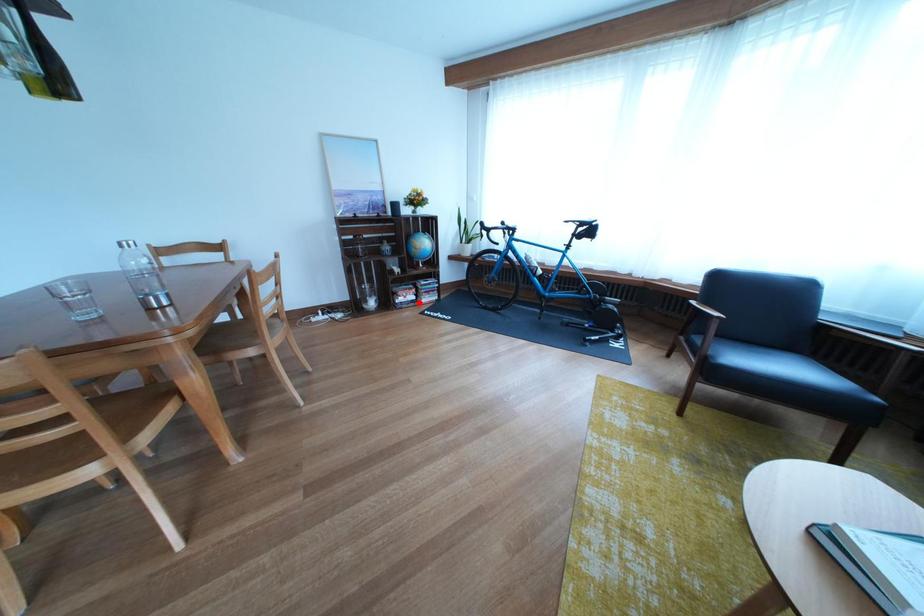
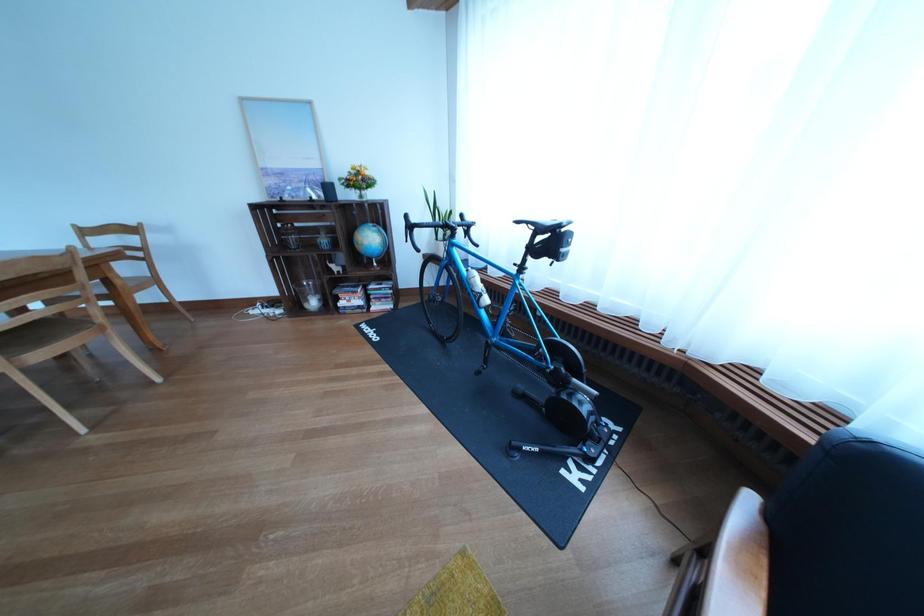
Question: I am providing you with two images of the same scene from different viewpoints. Image1 has a red point marked. In image2, the corresponding 3D location appears at what relative position? Reply with the corresponding letter.

Choices:
 (A) Closer
 (B) Farther

Answer: (B)